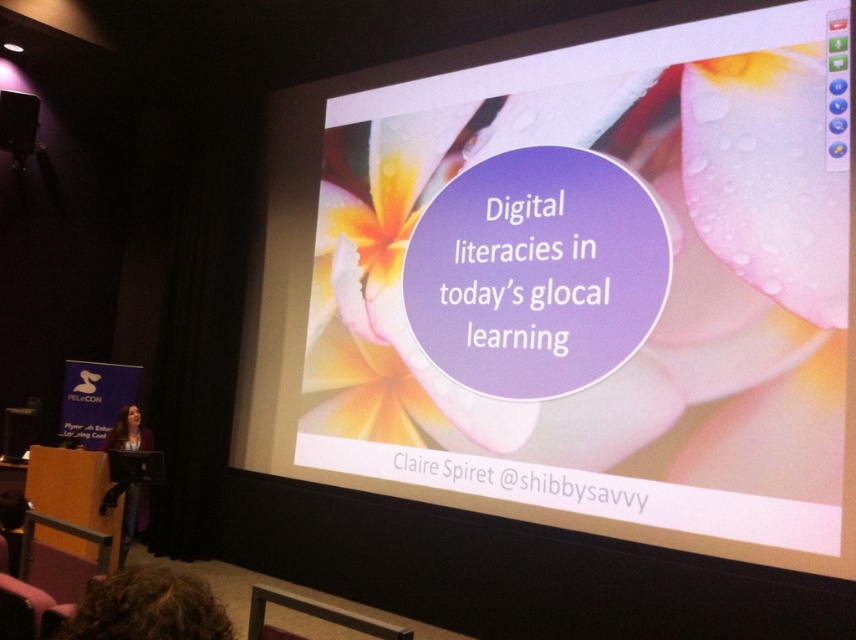
Based on the photo, does white glossy projection screen at upper center appear on the left side of curly hair at lower left?

In fact, white glossy projection screen at upper center is to the right of curly hair at lower left.

Is the position of white glossy projection screen at upper center more distant than that of curly hair at lower left?

Yes, it is.

Describe the element at coordinates (575, 282) in the screenshot. I see `white glossy projection screen at upper center` at that location.

Where is `white glossy projection screen at upper center`? white glossy projection screen at upper center is located at coordinates (575, 282).

Is dark purple sweater at lower left thinner than matte black podium at left?

Indeed, dark purple sweater at lower left has a lesser width compared to matte black podium at left.

Describe the element at coordinates (128, 433) in the screenshot. I see `dark purple sweater at lower left` at that location.

At what (x,y) coordinates should I click in order to perform the action: click on dark purple sweater at lower left. Please return your answer as a coordinate pair (x, y). This screenshot has height=640, width=856. Looking at the image, I should click on (128, 433).

Does point (348, 404) come in front of point (3, 148)?

Yes.

Who is more forward, (806, 372) or (9, 93)?

Point (806, 372) is in front.

This screenshot has height=640, width=856. What are the coordinates of `white glossy projection screen at upper center` in the screenshot? It's located at click(575, 282).